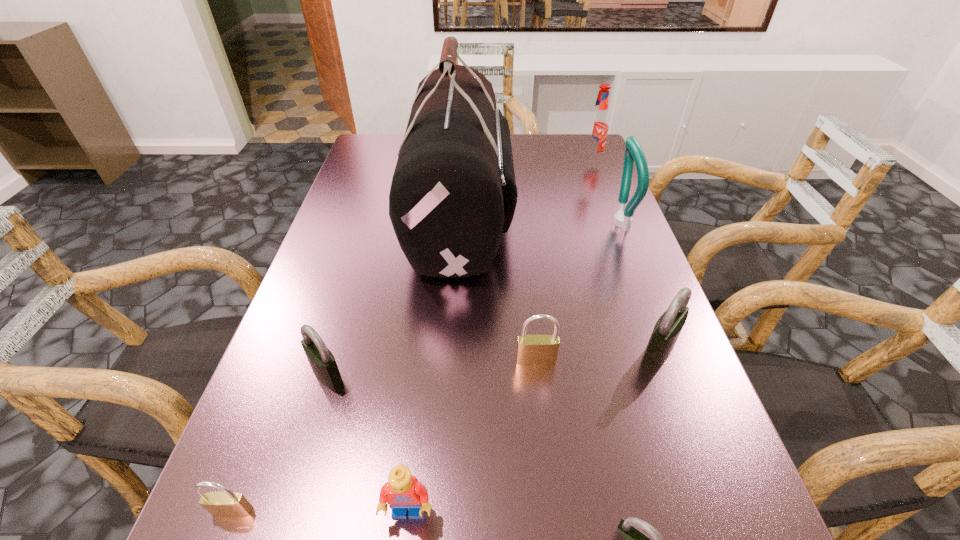
I want to click on vacant area situated 0.090m on the front-facing side of the third padlock from right to left, so click(x=541, y=412).

The width and height of the screenshot is (960, 540). I want to click on duffel bag located at the far edge, so click(453, 193).

This screenshot has height=540, width=960. In order to click on root beer present at the far edge in this screenshot , I will do `click(597, 128)`.

Identify the location of root beer present at the right edge. (597, 128).

Find the location of a particular element. This screenshot has height=540, width=960. bottle opener that is at the right edge is located at coordinates (633, 152).

Locate an element on the screen. The height and width of the screenshot is (540, 960). padlock present at the right edge is located at coordinates (667, 329).

The image size is (960, 540). I want to click on object that is at the far right corner, so click(597, 128).

I want to click on free location at the far edge of the desktop, so click(x=520, y=154).

The image size is (960, 540). I want to click on vacant area at the left edge of the desktop, so [x=344, y=188].

Image resolution: width=960 pixels, height=540 pixels. Identify the location of free region at the right edge of the desktop. (588, 240).